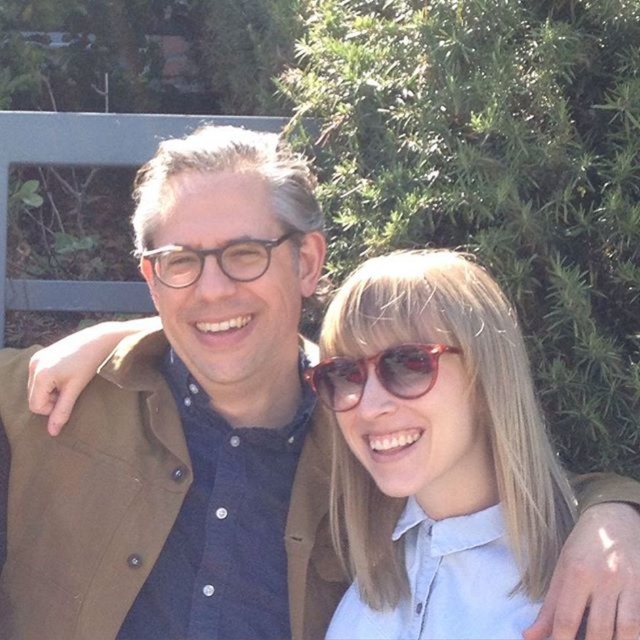
Question: Which of the following is the closest to the observer?

Choices:
 (A) matte red sunglasses at center
 (B) matte black glasses at center
 (C) translucent red sunglasses at center

Answer: (A)

Question: Is matte red sunglasses at center wider than matte black glasses at center?

Choices:
 (A) no
 (B) yes

Answer: (B)

Question: In this image, where is matte red sunglasses at center located relative to translucent red sunglasses at center?

Choices:
 (A) above
 (B) below

Answer: (B)

Question: Which point is closer to the camera taking this photo?

Choices:
 (A) (268, 256)
 (B) (339, 390)

Answer: (B)

Question: Based on their relative distances, which object is nearer to the matte black glasses at center?

Choices:
 (A) matte red sunglasses at center
 (B) translucent red sunglasses at center

Answer: (B)

Question: Does matte red sunglasses at center come behind matte black glasses at center?

Choices:
 (A) yes
 (B) no

Answer: (B)